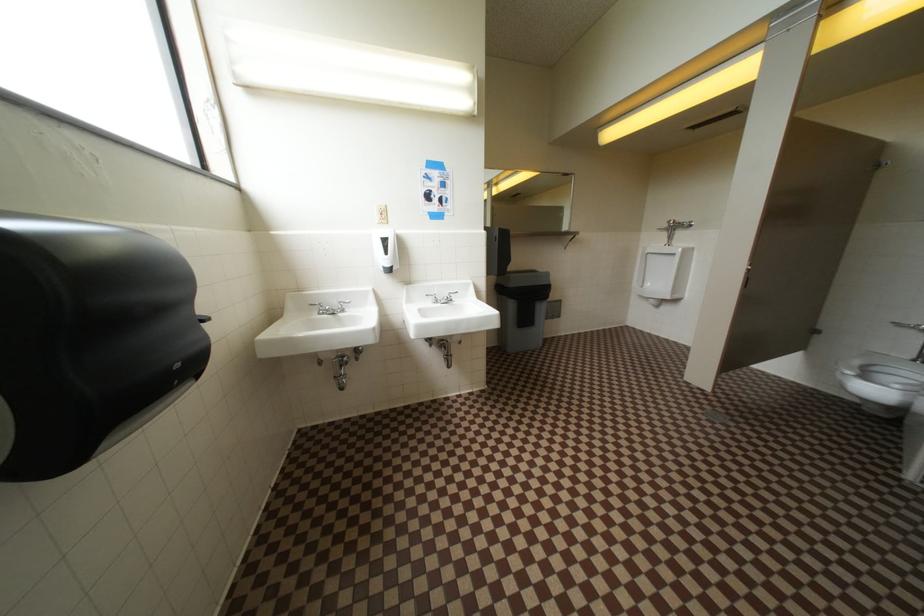
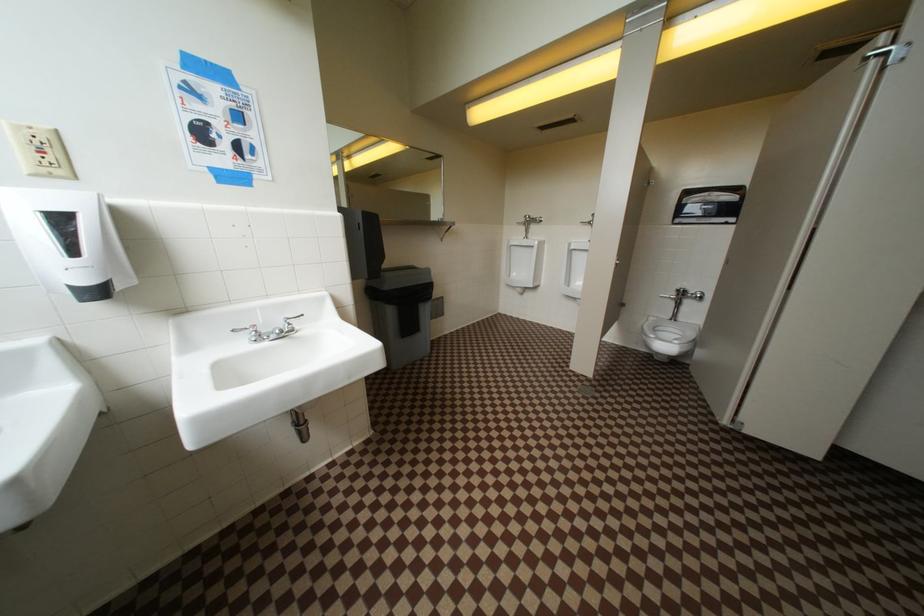
Question: The camera is either moving clockwise (left) or counter-clockwise (right) around the object. The first image is from the beginning of the video and the second image is from the end. Is the camera moving left or right when shooting the video?

Choices:
 (A) Left
 (B) Right

Answer: (A)